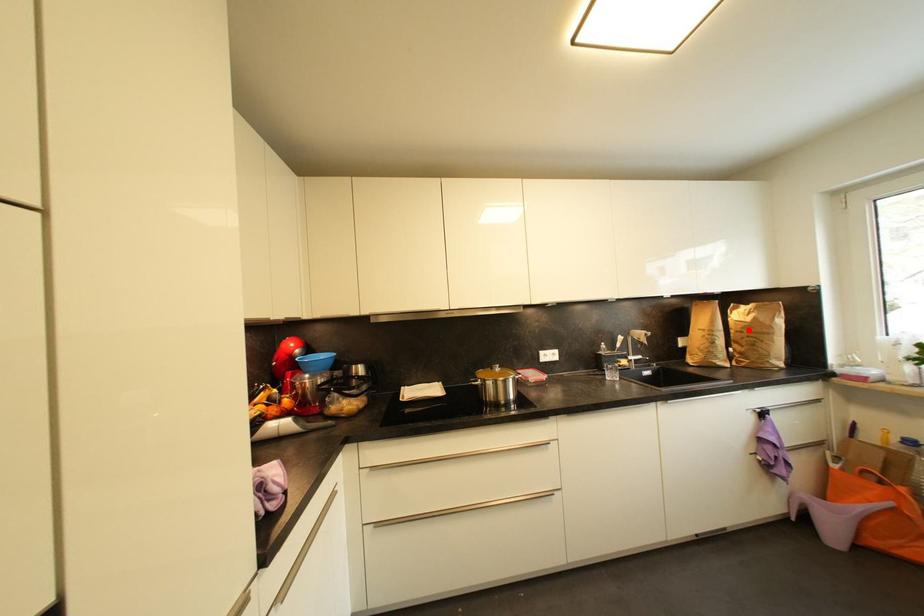
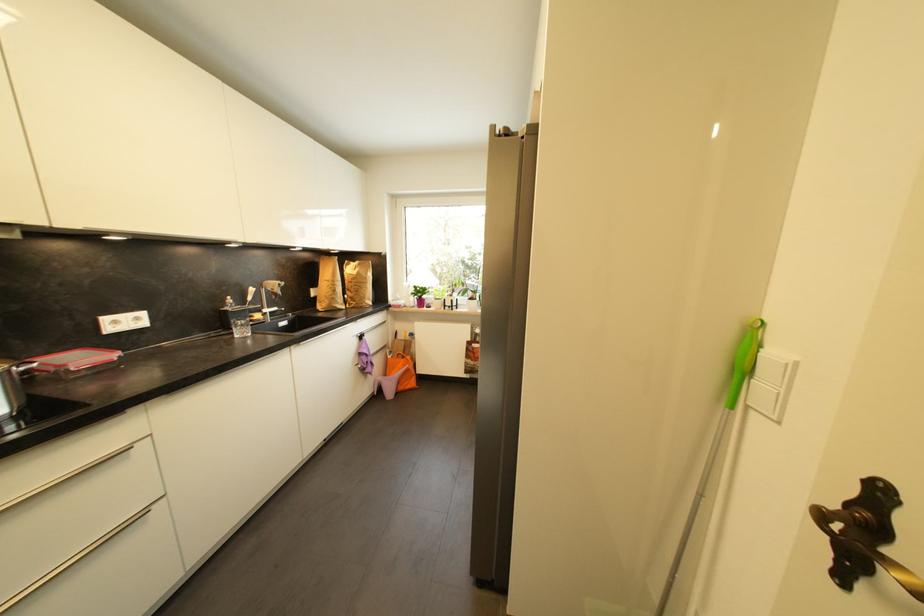
Question: I am providing you with two images of the same scene from different viewpoints. Given a red point in image1, look at the same physical point in image2. Is it:

Choices:
 (A) Closer to the viewpoint
 (B) Farther from the viewpoint

Answer: (A)